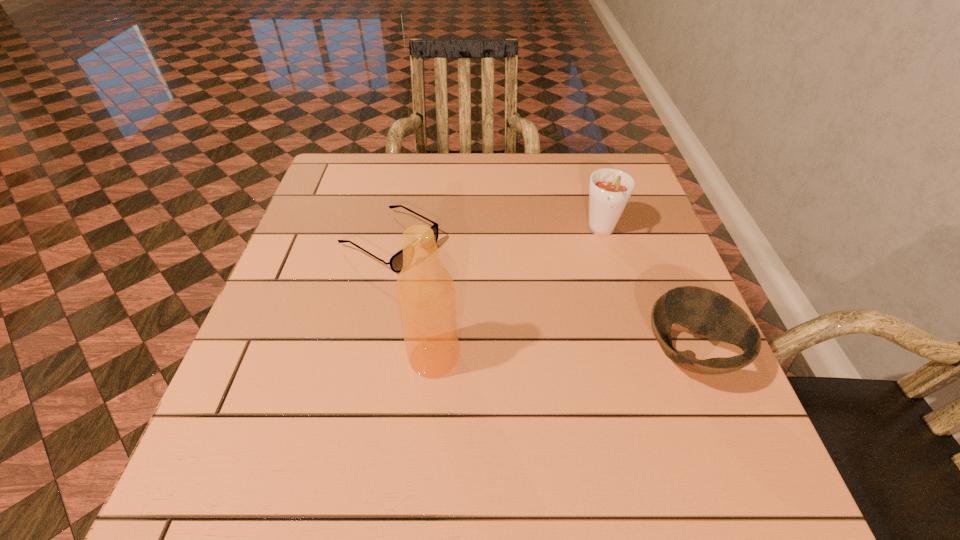
Where is `vacant space at the right edge`? vacant space at the right edge is located at coordinates (659, 279).

Identify the location of vacant space at the far left corner of the desktop. (320, 184).

Find the location of a particular element. vacant point at the near left corner is located at coordinates (295, 395).

This screenshot has width=960, height=540. Find the location of `free location at the far right corner`. free location at the far right corner is located at coordinates (581, 175).

Find the location of a particular element. Image resolution: width=960 pixels, height=540 pixels. free space between the second shortest object and the root beer is located at coordinates (645, 293).

In order to click on free spot between the second tallest object and the bowl in this screenshot , I will do `click(645, 293)`.

Image resolution: width=960 pixels, height=540 pixels. In order to click on vacant area that lies between the beer bottle and the third tallest object in this screenshot , I will do `click(562, 356)`.

In order to click on vacant point located between the bowl and the spectacles in this screenshot , I will do `click(540, 298)`.

You are a GUI agent. You are given a task and a screenshot of the screen. Output one action in this format:
    pyautogui.click(x=<x>, y=<y>)
    Task: Click on the vacant space that is in between the third shortest object and the spectacles
    
    Given the screenshot: What is the action you would take?
    pyautogui.click(x=496, y=237)

What are the coordinates of `vacant space that's between the third tallest object and the tallest object` in the screenshot? It's located at (562, 356).